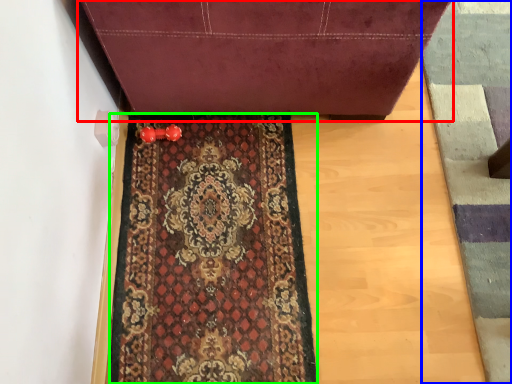
Question: Estimate the real-world distances between objects in this image. Which object is closer to furniture (highlighted by a red box), doormat (highlighted by a blue box) or mat (highlighted by a green box)?

Choices:
 (A) doormat
 (B) mat

Answer: (B)